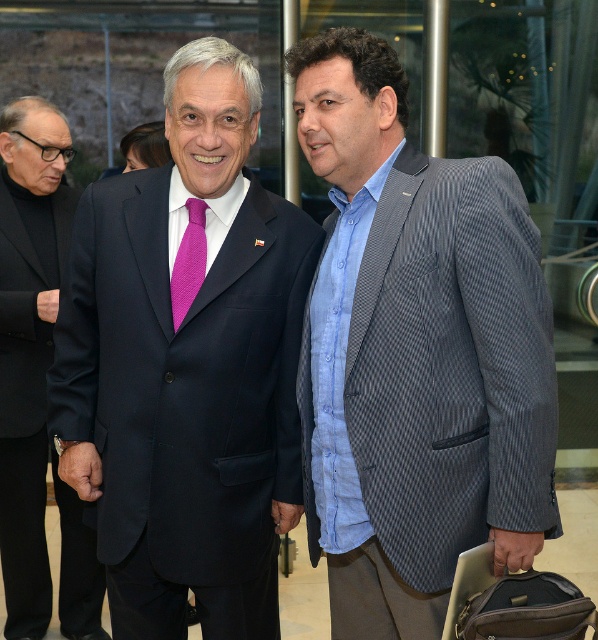
Between gray textured blazer at center and black wool suit at left, which one is positioned higher?

gray textured blazer at center

Does point (332, 92) come closer to viewer compared to point (62, 580)?

Yes, it is.

Image resolution: width=598 pixels, height=640 pixels. I want to click on gray textured blazer at center, so click(416, 353).

Measure the distance from black wool suit at left to matte black suit at center.

black wool suit at left is 38.50 inches from matte black suit at center.

Does point (13, 198) come closer to viewer compared to point (151, 502)?

No.

Where is `black wool suit at left`? This screenshot has height=640, width=598. black wool suit at left is located at coordinates (26, 392).

Which is more to the left, black wool suit at left or pink textured tie at center?

black wool suit at left

In the scene shown: Does black wool suit at left have a lesser height compared to pink textured tie at center?

Incorrect, black wool suit at left's height does not fall short of pink textured tie at center's.

Identify the location of black wool suit at left. (26, 392).

Where is `black wool suit at left`? Image resolution: width=598 pixels, height=640 pixels. black wool suit at left is located at coordinates (26, 392).